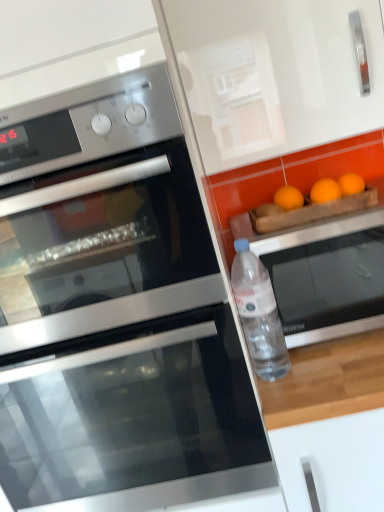
I want to click on vacant region to the right of transparent plastic bottle at right, so click(x=329, y=357).